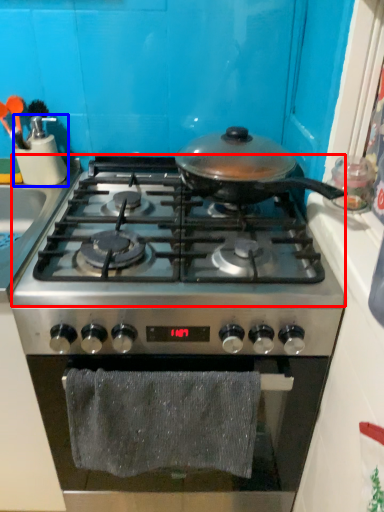
Question: Which object is further to the camera taking this photo, gas stove (highlighted by a red box) or kitchen appliance (highlighted by a blue box)?

Choices:
 (A) gas stove
 (B) kitchen appliance

Answer: (B)